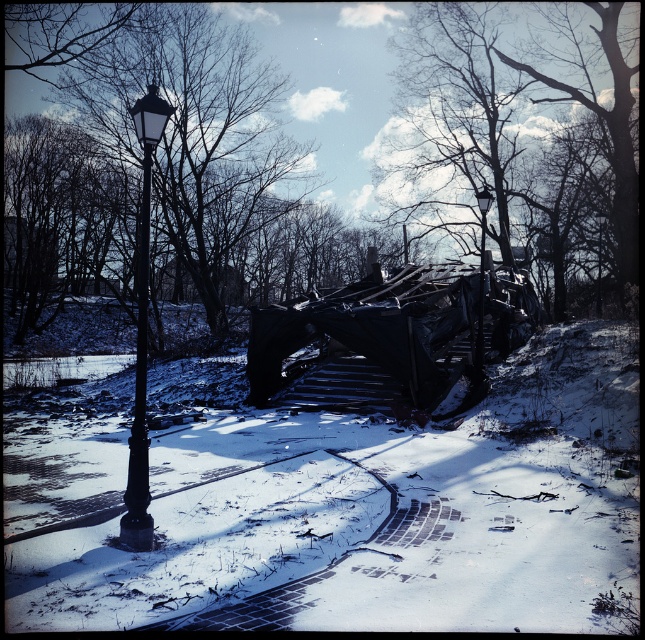
You are standing in the winter park scene. You see the dark brown wood tree at upper center and the black matte street light at left. Which object is higher in the scene?

The dark brown wood tree at upper center is higher than the black matte street light at left according to the description.

You are an urban planner assessing the placement of the dark brown wood tree at upper center and the black metal street light at upper center in the winter scene. Based on their sizes, which object would require more space for maintenance access?

The dark brown wood tree at upper center requires more space for maintenance access because it is bigger than the black metal street light at upper center.